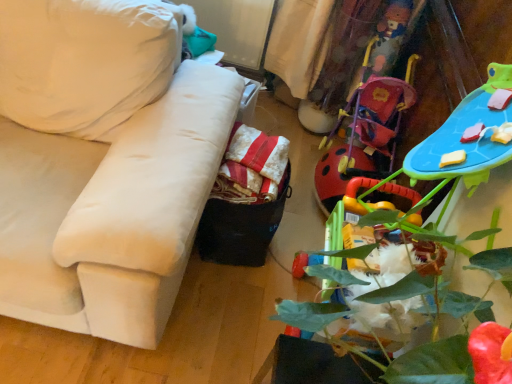
Question: Is red striped fabric at center inside or outside of green leafy plant at lower right?

Choices:
 (A) outside
 (B) inside

Answer: (A)

Question: Is red striped fabric at center wider or thinner than green leafy plant at lower right?

Choices:
 (A) thin
 (B) wide

Answer: (A)

Question: Estimate the real-world distances between objects in this image. Which object is closer to the velvet white couch at left?

Choices:
 (A) red striped fabric at center
 (B) green leafy plant at lower right

Answer: (A)

Question: Estimate the real-world distances between objects in this image. Which object is farther from the green leafy plant at lower right?

Choices:
 (A) velvet white couch at left
 (B) red striped fabric at center

Answer: (A)